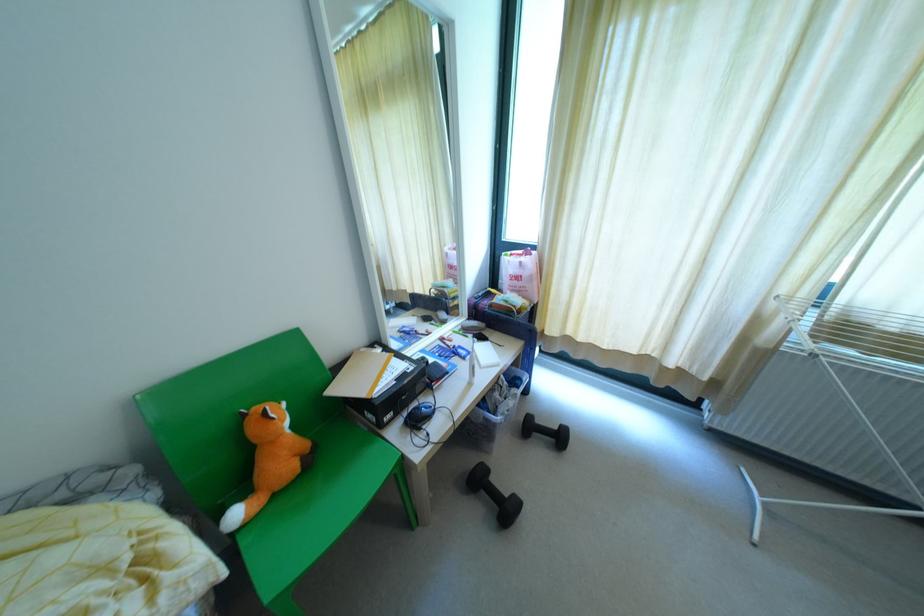
What do you see at coordinates (268, 460) in the screenshot?
I see `the orange stuffed fox` at bounding box center [268, 460].